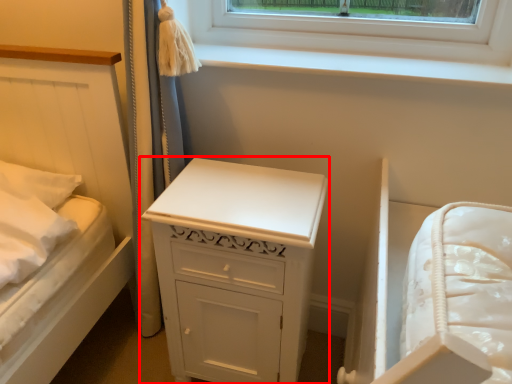
Question: From the image's perspective, where is chest of drawers (annotated by the red box) located relative to window sill?

Choices:
 (A) above
 (B) below

Answer: (B)